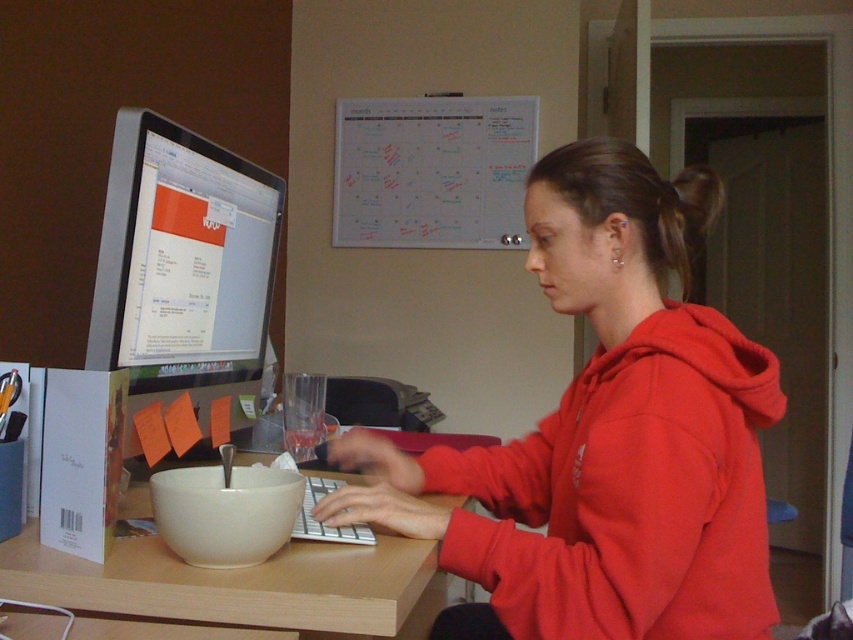
You are organizing a desk and need to place a new item between the red matte hoodie at center and the wooden table at center. Based on their positions, where should you place the item?

The red matte hoodie at center is to the right of the wooden table at center. Therefore, placing the item between them would require positioning it to the right of the wooden table at center and to the left of the red matte hoodie at center.

You are a delivery robot and need to place a package on the desk without blocking the satin black monitor at left. The desk is a rectangle with coordinates from point A at bottom left to point B at bottom right. The monitor is located at point C at 0.422, 0.216. What is the safest area to place the package?

The safest area to place the package would be away from the satin black monitor at left, ensuring it doesn not block the monitor located at point C at (183, 269). Consider placing it towards the edges of the desk where there are fewer objects, such as near point A or point B, but avoid the area around point C.